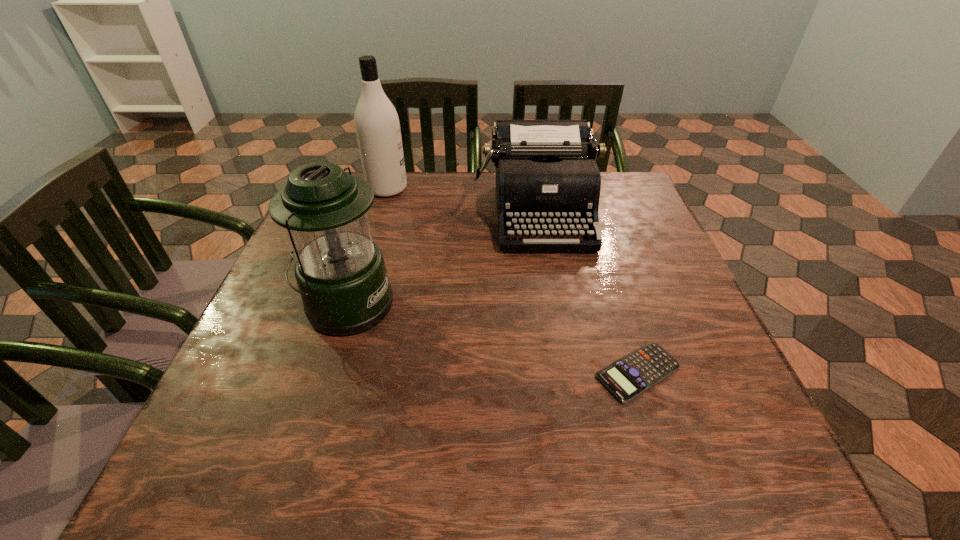
You are a GUI agent. You are given a task and a screenshot of the screen. Output one action in this format:
    pyautogui.click(x=<x>, y=<y>)
    Task: Click on the object that is the third nearest to the third tallest object
    The height and width of the screenshot is (540, 960).
    Given the screenshot: What is the action you would take?
    pyautogui.click(x=628, y=377)

Locate an element on the screen. object that is the closest one to the third tallest object is located at coordinates (340, 272).

Locate an element on the screen. The height and width of the screenshot is (540, 960). vacant area that satisfies the following two spatial constraints: 1. on the typing side of the typewriter; 2. on the left side of the shortest object is located at coordinates (566, 373).

You are a GUI agent. You are given a task and a screenshot of the screen. Output one action in this format:
    pyautogui.click(x=<x>, y=<y>)
    Task: Click on the free space that satisfies the following two spatial constraints: 1. on the typing side of the calculator; 2. on the right side of the third tallest object
    
    Given the screenshot: What is the action you would take?
    pyautogui.click(x=566, y=373)

At what (x,y) coordinates should I click in order to perform the action: click on vacant area that satisfies the following two spatial constraints: 1. on the front-facing side of the shampoo; 2. on the back side of the calculator. Please return your answer as a coordinate pair (x, y). Looking at the image, I should click on (332, 373).